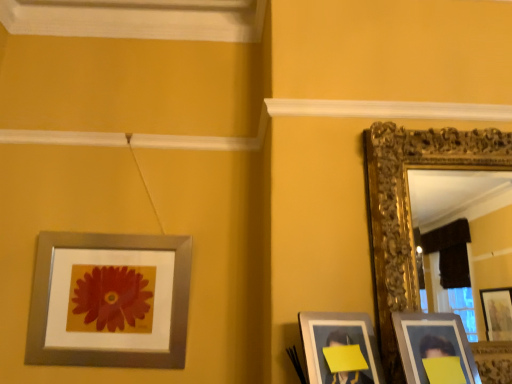
Question: Is silver metallic picture frame at upper left, which is the first picture frame in left-to-right order, positioned far away from matte silver picture frame at lower right, the 2th picture frame viewed from the left?

Choices:
 (A) no
 (B) yes

Answer: (A)

Question: From the image's perspective, is silver metallic picture frame at upper left, which is the first picture frame in left-to-right order, over matte silver picture frame at lower right, which is the third picture frame in right-to-left order?

Choices:
 (A) no
 (B) yes

Answer: (B)

Question: Is silver metallic picture frame at upper left, the fourth picture frame viewed from the right, to the left of matte silver picture frame at lower right, the 2th picture frame viewed from the left, from the viewer's perspective?

Choices:
 (A) no
 (B) yes

Answer: (B)

Question: Can you confirm if silver metallic picture frame at upper left, which is the first picture frame in left-to-right order, is taller than matte silver picture frame at lower right, the 2th picture frame viewed from the left?

Choices:
 (A) no
 (B) yes

Answer: (B)

Question: Does silver metallic picture frame at upper left, the fourth picture frame viewed from the right, have a larger size compared to matte silver picture frame at lower right, which is the third picture frame in right-to-left order?

Choices:
 (A) yes
 (B) no

Answer: (A)

Question: Is gold ornate mirror at right, the 4th picture frame viewed from the left, spatially inside silver metallic picture frame at upper left, the fourth picture frame viewed from the right, or outside of it?

Choices:
 (A) outside
 (B) inside

Answer: (A)

Question: Based on their positions, is gold ornate mirror at right, placed as the first picture frame when sorted from right to left, located to the left or right of silver metallic picture frame at upper left, the fourth picture frame viewed from the right?

Choices:
 (A) left
 (B) right

Answer: (B)

Question: Considering the positions of gold ornate mirror at right, the 4th picture frame viewed from the left, and silver metallic picture frame at upper left, the fourth picture frame viewed from the right, in the image, is gold ornate mirror at right, the 4th picture frame viewed from the left, bigger or smaller than silver metallic picture frame at upper left, the fourth picture frame viewed from the right,?

Choices:
 (A) small
 (B) big

Answer: (B)

Question: From a real-world perspective, relative to silver metallic picture frame at upper left, which is the first picture frame in left-to-right order, is gold ornate mirror at right, the 4th picture frame viewed from the left, vertically above or below?

Choices:
 (A) below
 (B) above

Answer: (B)

Question: In the image, is gold ornate mirror at right, placed as the first picture frame when sorted from right to left, on the left side or the right side of matte silver picture frame at lower right, which ranks as the third picture frame in left-to-right order?

Choices:
 (A) right
 (B) left

Answer: (A)

Question: From the image's perspective, is gold ornate mirror at right, the 4th picture frame viewed from the left, above or below matte silver picture frame at lower right, the second picture frame when ordered from right to left?

Choices:
 (A) above
 (B) below

Answer: (A)

Question: Considering the positions of point (365, 160) and point (467, 370), is point (365, 160) closer or farther from the camera than point (467, 370)?

Choices:
 (A) closer
 (B) farther

Answer: (B)

Question: From a real-world perspective, is gold ornate mirror at right, the 4th picture frame viewed from the left, physically located above or below matte silver picture frame at lower right, which ranks as the third picture frame in left-to-right order?

Choices:
 (A) above
 (B) below

Answer: (A)

Question: Relative to matte silver picture frame at lower right, the second picture frame when ordered from right to left, is silver metallic picture frame at upper left, the fourth picture frame viewed from the right, in front or behind?

Choices:
 (A) behind
 (B) front

Answer: (A)

Question: Would you say silver metallic picture frame at upper left, the fourth picture frame viewed from the right, is to the left or to the right of matte silver picture frame at lower right, which ranks as the third picture frame in left-to-right order, in the picture?

Choices:
 (A) left
 (B) right

Answer: (A)